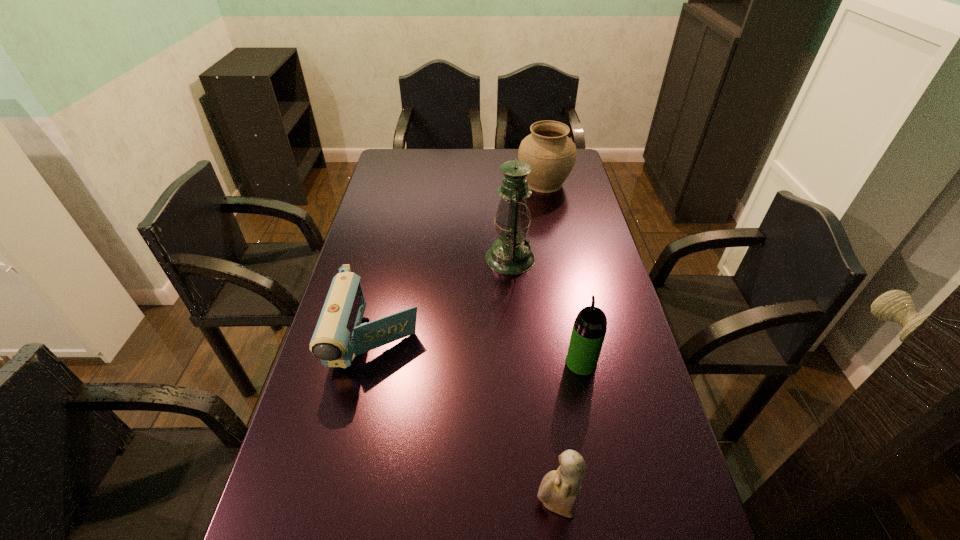
Locate an element on the screen. free space between the oil lamp and the camcorder is located at coordinates (444, 299).

Where is `empty space between the leftmost object and the urn`? Image resolution: width=960 pixels, height=540 pixels. empty space between the leftmost object and the urn is located at coordinates coord(460,261).

Locate an element on the screen. Image resolution: width=960 pixels, height=540 pixels. unoccupied position between the figurine and the thermos bottle is located at coordinates (568, 434).

This screenshot has height=540, width=960. I want to click on vacant area that lies between the fourth nearest object and the nearest object, so click(x=533, y=381).

I want to click on object that is the third nearest to the nearest object, so click(x=510, y=254).

This screenshot has height=540, width=960. Identify the location of object that stands as the second closest to the figurine. (339, 336).